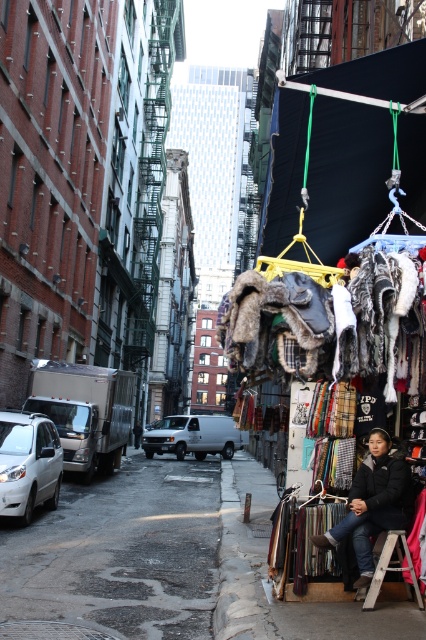
Is wet asphalt at lower left to the left of black fuzzy hat at lower right from the viewer's perspective?

Indeed, wet asphalt at lower left is positioned on the left side of black fuzzy hat at lower right.

Between wet asphalt at lower left and black fuzzy hat at lower right, which one appears on the right side from the viewer's perspective?

black fuzzy hat at lower right

Is point (28, 586) closer to viewer compared to point (383, 464)?

No, (28, 586) is further to viewer.

What are the coordinates of `wet asphalt at lower left` in the screenshot? It's located at click(x=120, y=552).

Is wet asphalt at lower left above smooth wooden board at lower right?

Correct, wet asphalt at lower left is located above smooth wooden board at lower right.

Does wet asphalt at lower left have a smaller size compared to smooth wooden board at lower right?

No, wet asphalt at lower left is not smaller than smooth wooden board at lower right.

Is point (43, 548) behind point (279, 609)?

Yes, point (43, 548) is farther from viewer.

Image resolution: width=426 pixels, height=640 pixels. I want to click on wet asphalt at lower left, so pyautogui.click(x=120, y=552).

Which is behind, point (255, 627) or point (359, 557)?

Point (359, 557)

Does smooth wooden board at lower right have a lesser height compared to black fuzzy hat at lower right?

Incorrect, smooth wooden board at lower right's height does not fall short of black fuzzy hat at lower right's.

Is point (374, 628) less distant than point (357, 484)?

Yes, it is.

The height and width of the screenshot is (640, 426). I want to click on smooth wooden board at lower right, so coord(265,577).